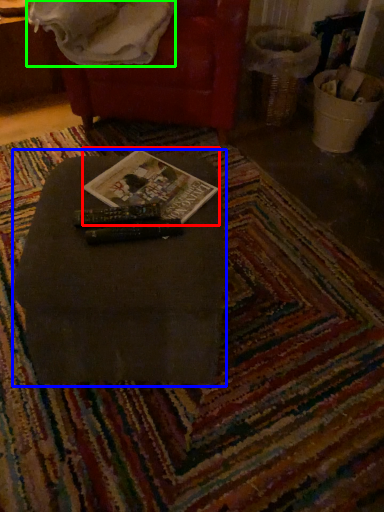
Question: Estimate the real-world distances between objects in this image. Which object is farther from paperback book (highlighted by a red box), table (highlighted by a blue box) or blanket (highlighted by a green box)?

Choices:
 (A) table
 (B) blanket

Answer: (B)